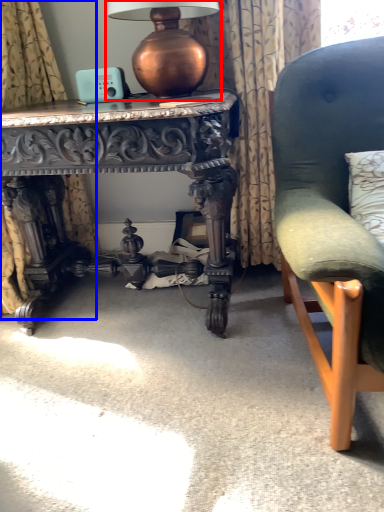
Question: Which object is further to the camera taking this photo, table lamp (highlighted by a red box) or curtain (highlighted by a blue box)?

Choices:
 (A) table lamp
 (B) curtain

Answer: (A)